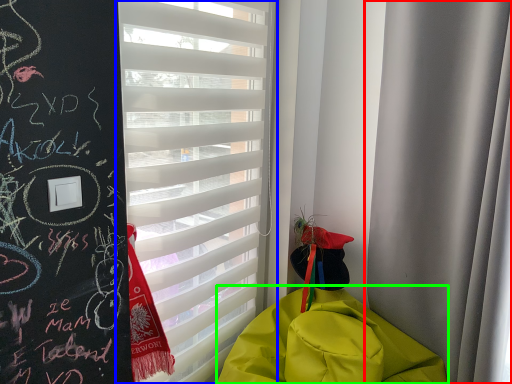
Question: Which object is the closest to the curtain (highlighted by a red box)? Choose among these: window blind (highlighted by a blue box) or blanket (highlighted by a green box).

Choices:
 (A) window blind
 (B) blanket

Answer: (B)